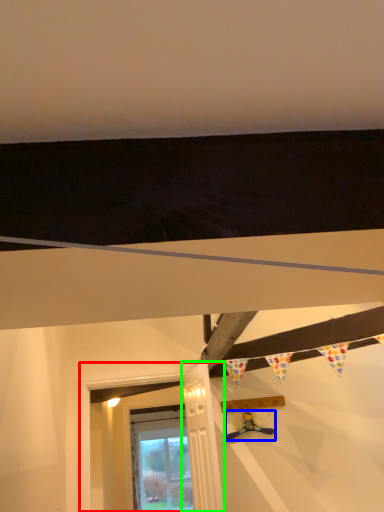
Question: Estimate the real-world distances between objects in this image. Which object is closer to window frame (highlighted by a red box), toy (highlighted by a blue box) or door (highlighted by a green box)?

Choices:
 (A) toy
 (B) door

Answer: (A)